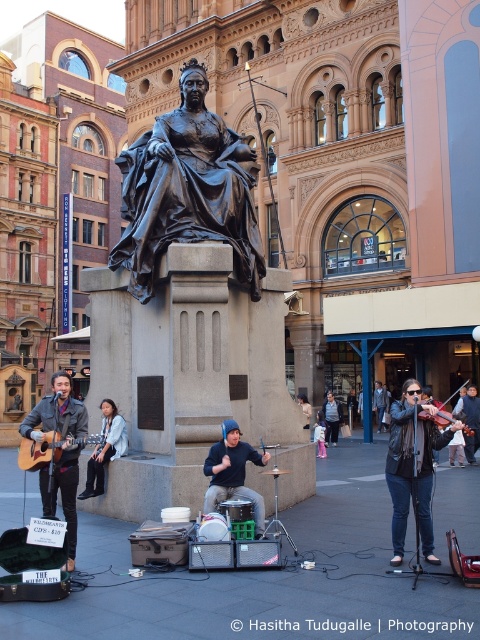
Does black polished statue at center appear under black drum set at center?

No, black polished statue at center is not below black drum set at center.

Does black polished statue at center have a lesser height compared to black drum set at center?

Incorrect, black polished statue at center's height does not fall short of black drum set at center's.

You are a GUI agent. You are given a task and a screenshot of the screen. Output one action in this format:
    pyautogui.click(x=<x>, y=<y>)
    Task: Click on the black polished statue at center
    
    Given the screenshot: What is the action you would take?
    pyautogui.click(x=187, y=189)

The image size is (480, 640). What are the coordinates of `black polished statue at center` in the screenshot? It's located at (187, 189).

In the scene shown: Who is positioned more to the left, black drum set at center or wooden violin at center?

black drum set at center

Between black drum set at center and wooden violin at center, which one appears on the right side from the viewer's perspective?

Positioned to the right is wooden violin at center.

Is point (261, 534) positioned in front of point (439, 422)?

No, it is behind (439, 422).

Locate an element on the screen. black drum set at center is located at coordinates (232, 472).

Does point (134, 156) come farther from viewer compared to point (327, 442)?

No.

Between point (202, 145) and point (331, 422), which one is positioned behind?

The point (331, 422) is more distant.

The height and width of the screenshot is (640, 480). What are the coordinates of `black polished statue at center` in the screenshot? It's located at (187, 189).